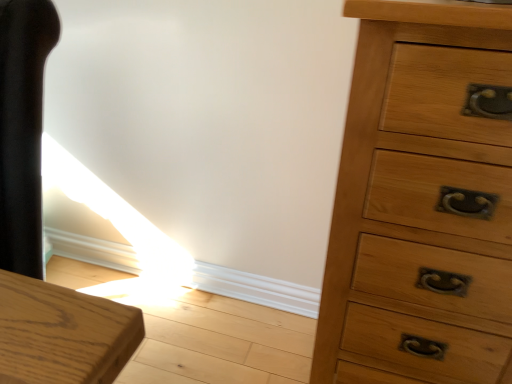
Describe the element at coordinates (422, 201) in the screenshot. I see `light brown wood chest of drawers at right` at that location.

In order to face light brown wood chest of drawers at right, should I rotate leftwards or rightwards?

You should rotate right by 22.393 degrees.

Where is `light brown wood chest of drawers at right`? light brown wood chest of drawers at right is located at coordinates (422, 201).

I want to click on light brown wood chest of drawers at right, so click(x=422, y=201).